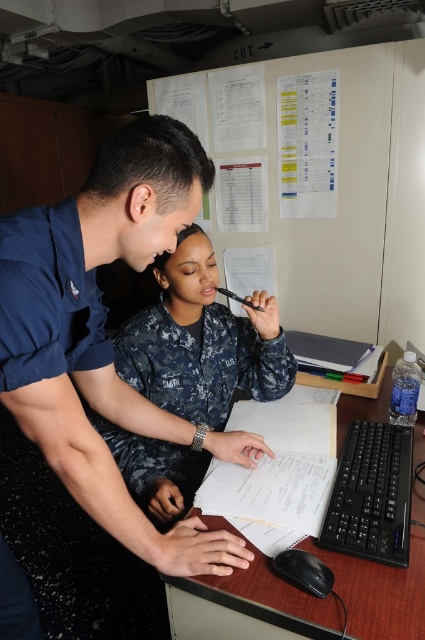
Question: Which object appears closest to the camera in this image?

Choices:
 (A) dull blue uniform at center
 (B) blue uniform at center
 (C) white paper at center

Answer: (B)

Question: Does blue uniform at center have a smaller size compared to dull blue uniform at center?

Choices:
 (A) no
 (B) yes

Answer: (B)

Question: Does blue uniform at center appear on the right side of dull blue uniform at center?

Choices:
 (A) yes
 (B) no

Answer: (B)

Question: Which object appears farthest from the camera in this image?

Choices:
 (A) dull blue uniform at center
 (B) white paper at center
 (C) blue uniform at center

Answer: (A)

Question: Which point is closer to the camera?

Choices:
 (A) (150, 380)
 (B) (227, 586)

Answer: (B)

Question: Is blue uniform at center smaller than dull blue uniform at center?

Choices:
 (A) yes
 (B) no

Answer: (A)